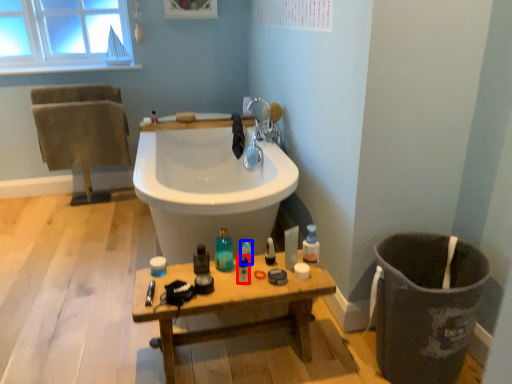
Question: Among these objects, which one is farthest to the camera, mouthwash (highlighted by a red box) or cleaning product (highlighted by a blue box)?

Choices:
 (A) mouthwash
 (B) cleaning product

Answer: (B)